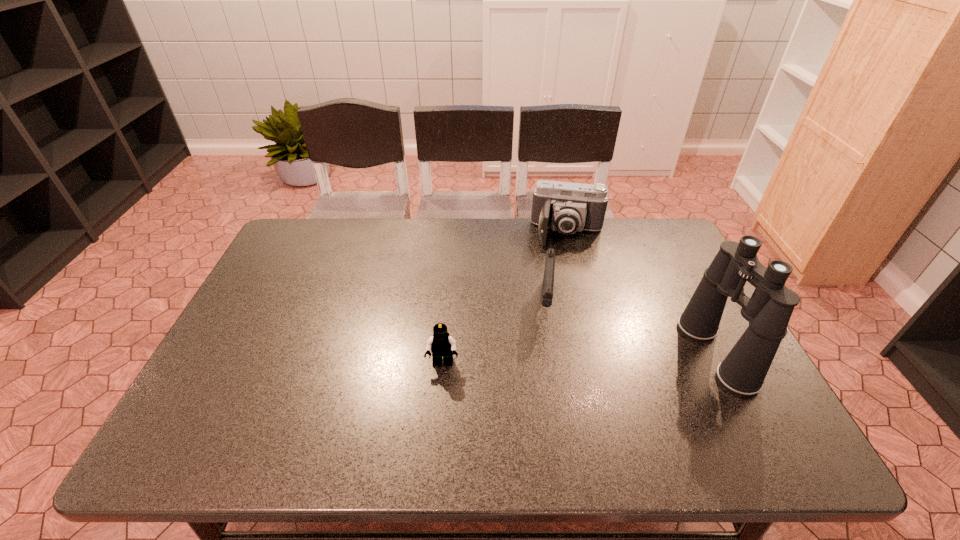
Where is `vacant area that lies between the pistol and the third shortest object`? vacant area that lies between the pistol and the third shortest object is located at coordinates (557, 268).

Locate an element on the screen. The width and height of the screenshot is (960, 540). unoccupied position between the leftmost object and the pistol is located at coordinates tap(494, 333).

Identify the location of free spot between the rightmost object and the pistol. (631, 328).

Where is `object that stands as the third closest to the camera`? The width and height of the screenshot is (960, 540). object that stands as the third closest to the camera is located at coordinates (441, 344).

Locate which object is the third closest to the camera. Please provide its 2D coordinates. Your answer should be formatted as a tuple, i.e. [(x, y)], where the tuple contains the x and y coordinates of a point satisfying the conditions above.

[(441, 344)]

This screenshot has width=960, height=540. In order to click on free location that satisfies the following two spatial constraints: 1. on the front side of the farthest object; 2. on the right side of the binoculars in this screenshot , I will do click(599, 353).

Image resolution: width=960 pixels, height=540 pixels. I want to click on vacant space that satisfies the following two spatial constraints: 1. on the front side of the rightmost object; 2. on the right side of the third shortest object, so click(599, 353).